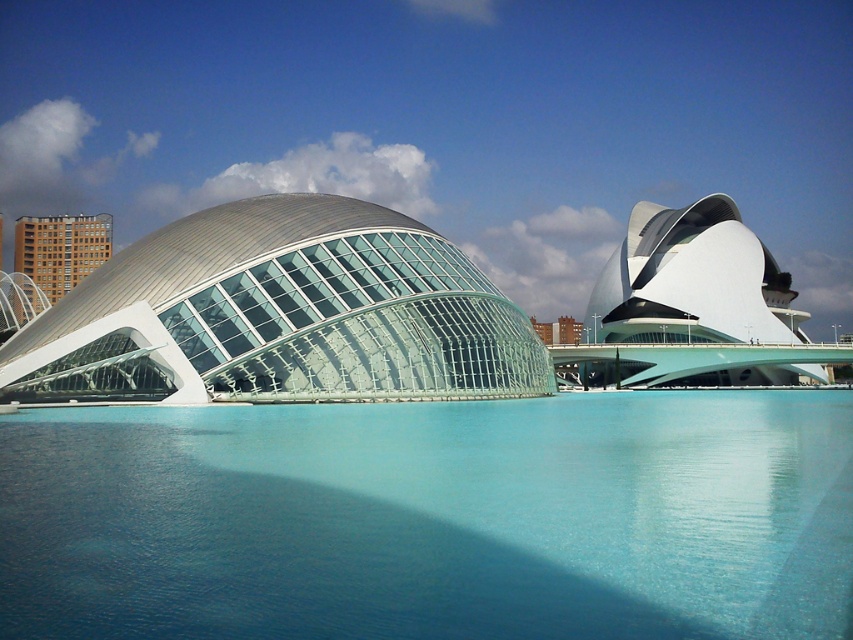
Question: Considering the real-world distances, which object is closest to the transparent glass dome at center?

Choices:
 (A) brown brick building at left
 (B) transparent blue water at center

Answer: (B)

Question: Which point is farther to the camera?

Choices:
 (A) (32, 252)
 (B) (155, 410)

Answer: (A)

Question: Which of the following is the farthest from the observer?

Choices:
 (A) transparent glass dome at center
 (B) transparent blue water at center
 (C) brown brick building at left

Answer: (C)

Question: Where is transparent blue water at center located in relation to brown brick building at left in the image?

Choices:
 (A) below
 (B) above

Answer: (A)

Question: Is transparent blue water at center below transparent glass dome at center?

Choices:
 (A) no
 (B) yes

Answer: (B)

Question: Is transparent blue water at center wider than transparent glass dome at center?

Choices:
 (A) no
 (B) yes

Answer: (B)